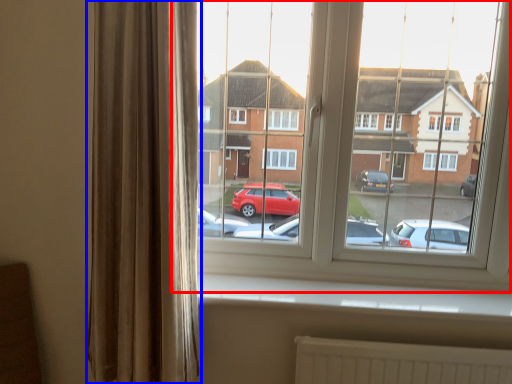
Question: Which object appears closest to the camera in this image, window (highlighted by a red box) or curtain (highlighted by a blue box)?

Choices:
 (A) window
 (B) curtain

Answer: (B)